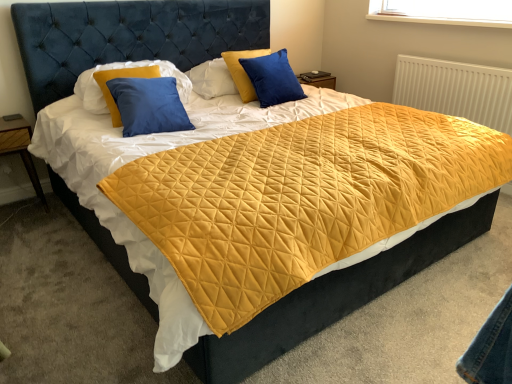
The width and height of the screenshot is (512, 384). What do you see at coordinates (129, 68) in the screenshot?
I see `blue matte pillow at upper left, which appears as the 1th pillow when viewed from the left` at bounding box center [129, 68].

Find the location of `blue matte pillow at upper left, which appears as the 1th pillow when viewed from the left`. blue matte pillow at upper left, which appears as the 1th pillow when viewed from the left is located at coordinates (129, 68).

Is wooden at left positioned beyond the bounds of blue matte pillow at upper left, the second pillow from the right?

Yes.

Between wooden at left and blue matte pillow at upper left, the second pillow from the right, which one has smaller width?

Thinner between the two is blue matte pillow at upper left, the second pillow from the right.

Which object is closer to the camera, wooden at left or blue matte pillow at upper left, the second pillow from the right?

blue matte pillow at upper left, the second pillow from the right, is closer to the camera.

From the image's perspective, which one is positioned lower, wooden at left or blue matte pillow at upper left, which appears as the 1th pillow when viewed from the left?

From the image's view, wooden at left is below.

From a real-world perspective, who is located higher, blue matte pillow at upper left, which appears as the 1th pillow when viewed from the left, or blue velvet pillow at upper center, the first pillow positioned from the right?

blue matte pillow at upper left, which appears as the 1th pillow when viewed from the left, from a real-world perspective.

Could you tell me if blue matte pillow at upper left, the second pillow from the right, is facing blue velvet pillow at upper center, the first pillow positioned from the right?

No.

Between blue matte pillow at upper left, which appears as the 1th pillow when viewed from the left, and blue velvet pillow at upper center, the first pillow positioned from the right, which one appears on the left side from the viewer's perspective?

From the viewer's perspective, blue matte pillow at upper left, which appears as the 1th pillow when viewed from the left, appears more on the left side.

What's the angular difference between blue matte pillow at upper left, the second pillow from the right, and blue velvet pillow at upper center, which ranks as the 2th pillow in left-to-right order,'s facing directions?

2.16 degrees separate the facing orientations of blue matte pillow at upper left, the second pillow from the right, and blue velvet pillow at upper center, which ranks as the 2th pillow in left-to-right order.

Does white textured radiator at upper right turn towards blue matte pillow at upper left, which appears as the 1th pillow when viewed from the left?

Yes, white textured radiator at upper right is facing blue matte pillow at upper left, which appears as the 1th pillow when viewed from the left.

Locate an element on the screen. Image resolution: width=512 pixels, height=384 pixels. the 2nd pillow positioned above the white textured radiator at upper right (from a real-world perspective) is located at coordinates (129, 68).

Would you consider white textured radiator at upper right to be distant from blue matte pillow at upper left, which appears as the 1th pillow when viewed from the left?

white textured radiator at upper right is positioned a significant distance from blue matte pillow at upper left, which appears as the 1th pillow when viewed from the left.

Looking at their sizes, would you say white textured radiator at upper right is wider or thinner than wooden at left?

white textured radiator at upper right is thinner than wooden at left.

Is white textured radiator at upper right bigger or smaller than wooden at left?

Clearly, white textured radiator at upper right is larger in size than wooden at left.

Is white textured radiator at upper right oriented towards wooden at left?

Yes, white textured radiator at upper right is facing wooden at left.

Locate an element on the screen. The height and width of the screenshot is (384, 512). radiator that appears behind the wooden at left is located at coordinates (455, 90).

Considering the relative sizes of blue matte pillow at upper left, the second pillow from the right, and wooden at left in the image provided, is blue matte pillow at upper left, the second pillow from the right, smaller than wooden at left?

No, blue matte pillow at upper left, the second pillow from the right, is not smaller than wooden at left.

Is the depth of blue matte pillow at upper left, the second pillow from the right, less than that of wooden at left?

Yes.

Is blue matte pillow at upper left, which appears as the 1th pillow when viewed from the left, situated inside wooden at left or outside?

blue matte pillow at upper left, which appears as the 1th pillow when viewed from the left, is outside wooden at left.

From a real-world perspective, is blue matte pillow at upper left, the second pillow from the right, over wooden at left?

Yes, from a real-world perspective, blue matte pillow at upper left, the second pillow from the right, is above wooden at left.

Is wooden at left outside of white textured radiator at upper right?

Yes.

Does point (10, 140) come closer to viewer compared to point (497, 103)?

Yes.

Consider the image. Considering the relative sizes of wooden at left and white textured radiator at upper right in the image provided, is wooden at left wider than white textured radiator at upper right?

Yes.

From the image's perspective, which object appears higher, wooden at left or white textured radiator at upper right?

white textured radiator at upper right, from the image's perspective.

Visually, is blue velvet pillow at upper center, the first pillow positioned from the right, positioned to the left or to the right of white textured radiator at upper right?

In the image, blue velvet pillow at upper center, the first pillow positioned from the right, appears on the left side of white textured radiator at upper right.

Considering the sizes of blue velvet pillow at upper center, the first pillow positioned from the right, and white textured radiator at upper right in the image, is blue velvet pillow at upper center, the first pillow positioned from the right, bigger or smaller than white textured radiator at upper right?

Considering their sizes, blue velvet pillow at upper center, the first pillow positioned from the right, takes up less space than white textured radiator at upper right.

From a real-world perspective, is blue velvet pillow at upper center, the first pillow positioned from the right, located beneath white textured radiator at upper right?

No, from a real-world perspective, blue velvet pillow at upper center, the first pillow positioned from the right, is not below white textured radiator at upper right.

In order to click on radiator on the right of the blue velvet pillow at upper center, which ranks as the 2th pillow in left-to-right order in this screenshot , I will do `click(455, 90)`.

Identify the location of pillow in front of the wooden at left. The height and width of the screenshot is (384, 512). (129, 68).

The width and height of the screenshot is (512, 384). What are the coordinates of `pillow that is above the blue velvet pillow at upper center, which ranks as the 2th pillow in left-to-right order (from a real-world perspective)` in the screenshot? It's located at (129, 68).

Estimate the real-world distances between objects in this image. Which object is closer to white textured radiator at upper right, blue velvet pillow at upper center, the first pillow positioned from the right, or blue matte pillow at upper left, the second pillow from the right?

blue velvet pillow at upper center, the first pillow positioned from the right, is positioned closer to the anchor white textured radiator at upper right.

When comparing their distances from blue velvet pillow at upper center, the first pillow positioned from the right, does wooden at left or blue matte pillow at upper left, which appears as the 1th pillow when viewed from the left, seem further?

wooden at left is positioned further to the anchor blue velvet pillow at upper center, the first pillow positioned from the right.

Based on their spatial positions, is wooden at left or white textured radiator at upper right closer to blue velvet pillow at upper center, the first pillow positioned from the right?

Among the two, white textured radiator at upper right is located nearer to blue velvet pillow at upper center, the first pillow positioned from the right.

Estimate the real-world distances between objects in this image. Which object is further from wooden at left, blue matte pillow at upper left, the second pillow from the right, or white textured radiator at upper right?

Based on the image, white textured radiator at upper right appears to be further to wooden at left.

From the image, which object appears to be farther from wooden at left, white textured radiator at upper right or blue matte pillow at upper left, the second pillow from the right?

The object further to wooden at left is white textured radiator at upper right.

When comparing their distances from blue matte pillow at upper left, the second pillow from the right, does wooden at left or white textured radiator at upper right seem further?

white textured radiator at upper right is positioned further to the anchor blue matte pillow at upper left, the second pillow from the right.

Which object lies further to the anchor point blue matte pillow at upper left, which appears as the 1th pillow when viewed from the left, blue velvet pillow at upper center, which ranks as the 2th pillow in left-to-right order, or white textured radiator at upper right?

white textured radiator at upper right is positioned further to the anchor blue matte pillow at upper left, which appears as the 1th pillow when viewed from the left.

From the image, which object appears to be farther from wooden at left, blue velvet pillow at upper center, which ranks as the 2th pillow in left-to-right order, or white textured radiator at upper right?

Among the two, white textured radiator at upper right is located further to wooden at left.

The image size is (512, 384). I want to click on pillow between blue matte pillow at upper left, which appears as the 1th pillow when viewed from the left, and white textured radiator at upper right, so click(273, 79).

The width and height of the screenshot is (512, 384). Identify the location of pillow between wooden at left and blue velvet pillow at upper center, which ranks as the 2th pillow in left-to-right order, from left to right. (129, 68).